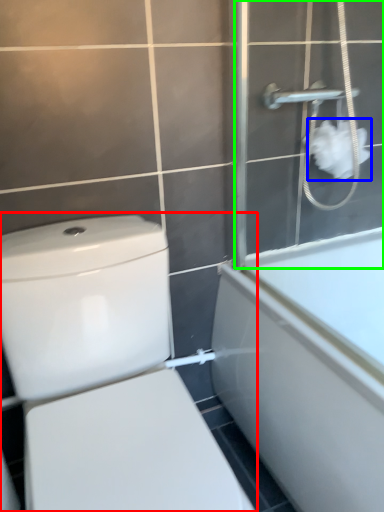
Question: Estimate the real-world distances between objects in this image. Which object is farther from toilet (highlighted by a red box), toilet paper (highlighted by a blue box) or screen door (highlighted by a green box)?

Choices:
 (A) toilet paper
 (B) screen door

Answer: (A)